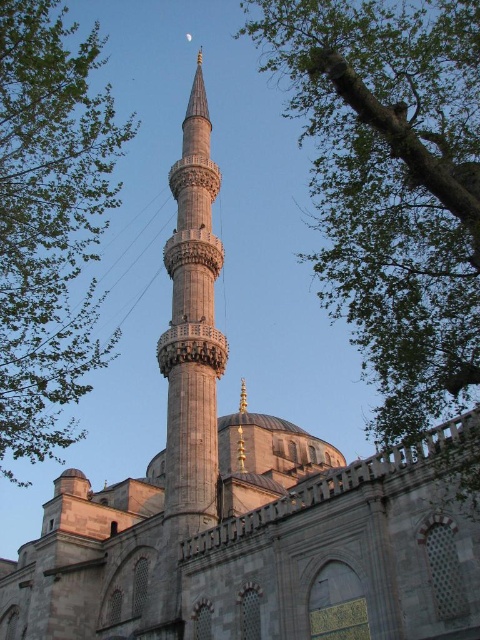
Question: Can you confirm if green leafy tree at upper right is positioned to the right of gray stone minaret at center?

Choices:
 (A) yes
 (B) no

Answer: (A)

Question: Among these points, which one is farthest from the camera?

Choices:
 (A) (448, 90)
 (B) (52, 260)
 (C) (176, 417)

Answer: (C)

Question: Is green leafy tree at upper left to the right of gray stone minaret at center from the viewer's perspective?

Choices:
 (A) no
 (B) yes

Answer: (A)

Question: Based on their relative distances, which object is nearer to the green leafy tree at upper left?

Choices:
 (A) green leafy tree at upper right
 (B) gray stone minaret at center

Answer: (B)

Question: Does green leafy tree at upper left have a lesser width compared to gray stone minaret at center?

Choices:
 (A) no
 (B) yes

Answer: (A)

Question: Which point is closer to the camera taking this photo?

Choices:
 (A) (61, 106)
 (B) (169, 276)

Answer: (A)